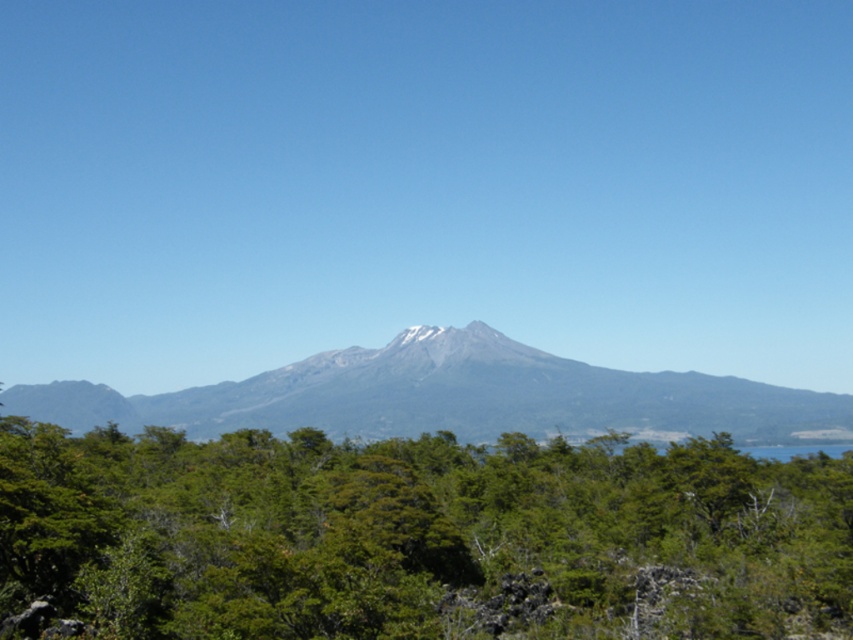
Question: Does green leafy tree at center lie in front of gray/rocky mountain at center?

Choices:
 (A) no
 (B) yes

Answer: (B)

Question: Observing the image, what is the correct spatial positioning of green leafy tree at center in reference to gray/rocky mountain at center?

Choices:
 (A) below
 (B) above

Answer: (B)

Question: Which object appears farthest from the camera in this image?

Choices:
 (A) gray/rocky mountain at center
 (B) green leafy tree at center

Answer: (A)

Question: Can you confirm if green leafy tree at center is positioned to the left of gray/rocky mountain at center?

Choices:
 (A) no
 (B) yes

Answer: (A)

Question: Which of the following is the farthest from the observer?

Choices:
 (A) pyautogui.click(x=737, y=627)
 (B) pyautogui.click(x=485, y=426)

Answer: (B)

Question: Among these points, which one is nearest to the camera?

Choices:
 (A) (80, 476)
 (B) (175, 422)

Answer: (A)